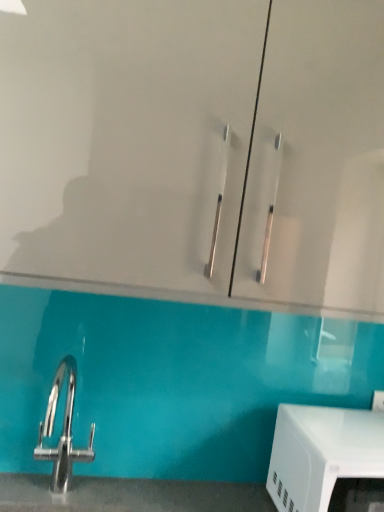
Question: Should I look upward or downward to see transparent glass cabinet at upper center?

Choices:
 (A) down
 (B) up

Answer: (B)

Question: Is white glossy microwave at lower right looking in the opposite direction of transparent glass cabinet at upper center?

Choices:
 (A) yes
 (B) no

Answer: (B)

Question: Is white glossy microwave at lower right aimed at transparent glass cabinet at upper center?

Choices:
 (A) yes
 (B) no

Answer: (B)

Question: Is the depth of white glossy microwave at lower right less than that of transparent glass cabinet at upper center?

Choices:
 (A) no
 (B) yes

Answer: (A)

Question: Would you say white glossy microwave at lower right is outside transparent glass cabinet at upper center?

Choices:
 (A) no
 (B) yes

Answer: (B)

Question: From the image's perspective, would you say white glossy microwave at lower right is positioned over transparent glass cabinet at upper center?

Choices:
 (A) no
 (B) yes

Answer: (A)

Question: From a real-world perspective, is white glossy microwave at lower right beneath transparent glass cabinet at upper center?

Choices:
 (A) yes
 (B) no

Answer: (A)

Question: Is transparent glass cabinet at upper center oriented towards white glossy microwave at lower right?

Choices:
 (A) yes
 (B) no

Answer: (B)

Question: From a real-world perspective, is transparent glass cabinet at upper center beneath white glossy microwave at lower right?

Choices:
 (A) yes
 (B) no

Answer: (B)

Question: Does transparent glass cabinet at upper center lie behind white glossy microwave at lower right?

Choices:
 (A) yes
 (B) no

Answer: (B)

Question: Is transparent glass cabinet at upper center not close to white glossy microwave at lower right?

Choices:
 (A) no
 (B) yes

Answer: (A)

Question: Considering the relative positions of transparent glass cabinet at upper center and white glossy microwave at lower right in the image provided, is transparent glass cabinet at upper center to the left of white glossy microwave at lower right from the viewer's perspective?

Choices:
 (A) yes
 (B) no

Answer: (A)

Question: Is transparent glass cabinet at upper center wider than white glossy microwave at lower right?

Choices:
 (A) no
 (B) yes

Answer: (B)

Question: From the image's perspective, is white glossy microwave at lower right positioned above or below transparent glass cabinet at upper center?

Choices:
 (A) above
 (B) below

Answer: (B)